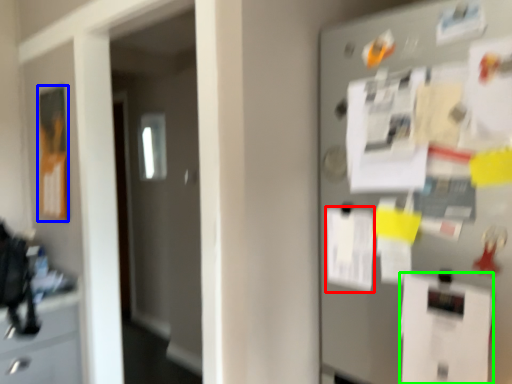
Question: Which object is the farthest from paper (highlighted by a red box)? Choose among these: poster (highlighted by a blue box) or paper (highlighted by a green box).

Choices:
 (A) poster
 (B) paper

Answer: (A)